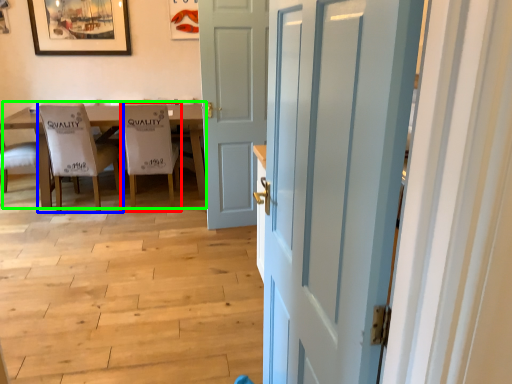
Question: Which object is positioned closest to chair (highlighted by a red box)? Select from chair (highlighted by a blue box) and kitchen & dining room table (highlighted by a green box).

Choices:
 (A) chair
 (B) kitchen & dining room table

Answer: (A)